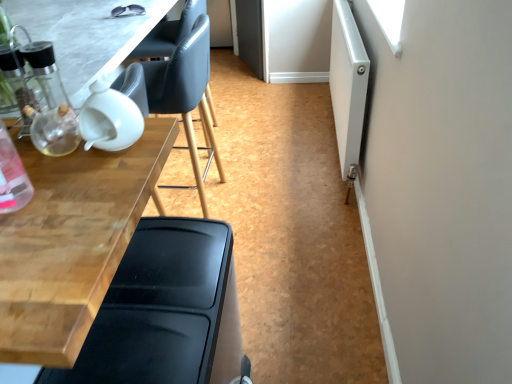
Where is `vacant space situated on the left part of white matte screen door at right`? The width and height of the screenshot is (512, 384). vacant space situated on the left part of white matte screen door at right is located at coordinates (275, 145).